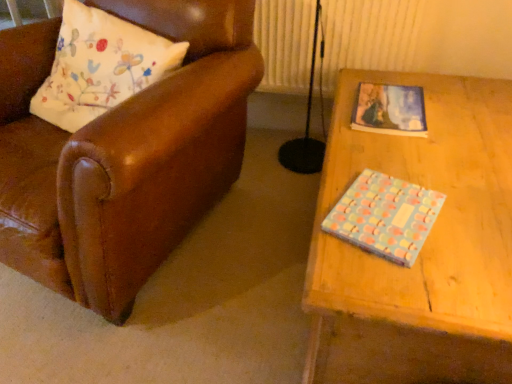
Where is `free space above pastel-patterned paper at upper right, the 2th book in the front-to-back sequence (from a real-world perspective)`? The image size is (512, 384). free space above pastel-patterned paper at upper right, the 2th book in the front-to-back sequence (from a real-world perspective) is located at coordinates (398, 109).